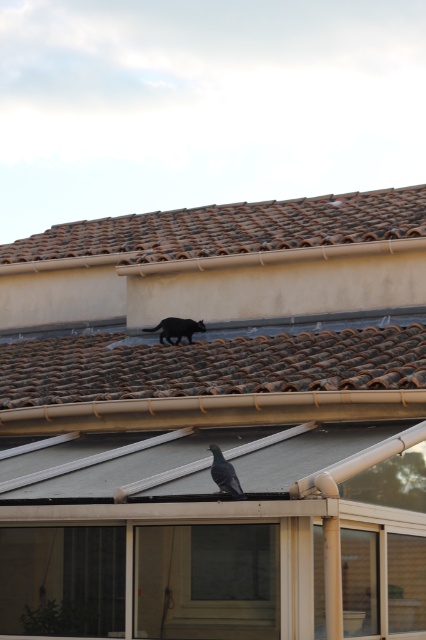
Is point (184, 243) more distant than point (167, 333)?

Yes, point (184, 243) is farther from viewer.

Is point (273, 240) behind point (203, 321)?

Yes, it is.

This screenshot has width=426, height=640. What are the coordinates of `brown clay tiles at upper center` in the screenshot? It's located at (230, 228).

Who is positioned more to the right, shiny blue pigeon at center or black fur cat at upper center?

shiny blue pigeon at center

Is shiny blue pigeon at center shorter than black fur cat at upper center?

Yes, shiny blue pigeon at center is shorter than black fur cat at upper center.

This screenshot has width=426, height=640. Describe the element at coordinates (224, 474) in the screenshot. I see `shiny blue pigeon at center` at that location.

This screenshot has width=426, height=640. I want to click on shiny blue pigeon at center, so click(x=224, y=474).

Looking at this image, which is below, brown tile roof at center or black fur cat at upper center?

brown tile roof at center is lower down.

Does brown tile roof at center have a greater width compared to black fur cat at upper center?

Yes.

Which is behind, point (2, 368) or point (192, 333)?

The point (2, 368) is more distant.

This screenshot has width=426, height=640. In order to click on brown tile roof at center in this screenshot , I will do `click(210, 365)`.